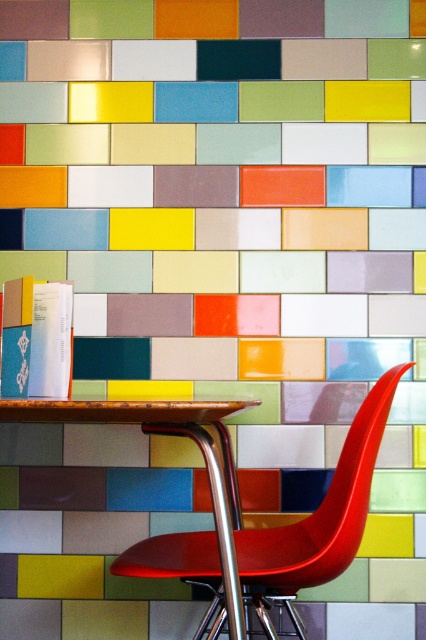
You are a painter standing in front of the vibrant tiled wall. You want to place your shiny red plastic chair at center and wooden table at center in such a way that the chair is visible from the wall. Given their sizes, which object should be placed closer to the wall to ensure the chair is not blocked?

The shiny red plastic chair at center is taller than the wooden table at center. To ensure the chair is visible from the wall, the wooden table at center should be placed closer to the wall so that the shorter table does not block the view of the taller chair.

You are planning to place a new plant pot that is 1.2 meters wide between the shiny red plastic chair at center and the wooden table at center. Based on the scene description, will the plant pot fit in the space between them?

The shiny red plastic chair at center is wider than the wooden table at center. However, the exact width of the space between them isn

Consider the image. You are planning to place a small potted plant between the shiny red plastic chair at center and the wooden table at center. Since the chair is bigger than the table, which side of the chair should you place the plant to ensure it is closer to the smaller object?

The wooden table at center is smaller than the shiny red plastic chair at center. To place the potted plant closer to the smaller object, you should position it near the wooden table at center side of the chair.